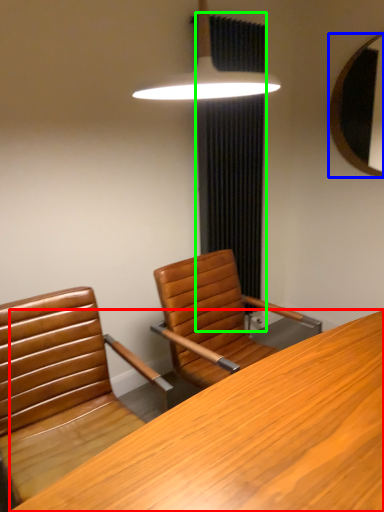
Question: Which is farther away from desk (highlighted by a red box)? mirror (highlighted by a blue box) or curtain (highlighted by a green box)?

Choices:
 (A) mirror
 (B) curtain

Answer: (A)